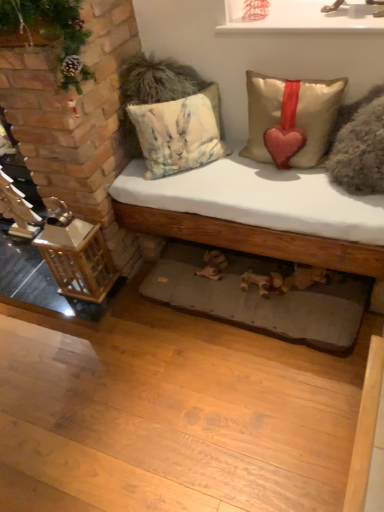
Question: Is watercolor fabric pillow at center, the third pillow from the right, facing towards white glossy shelf at upper center?

Choices:
 (A) no
 (B) yes

Answer: (A)

Question: Are watercolor fabric pillow at center, which is the 1th pillow in left-to-right order, and white glossy shelf at upper center far apart?

Choices:
 (A) yes
 (B) no

Answer: (B)

Question: From the image's perspective, is watercolor fabric pillow at center, the third pillow from the right, under white glossy shelf at upper center?

Choices:
 (A) yes
 (B) no

Answer: (A)

Question: Considering the relative sizes of watercolor fabric pillow at center, which is the 1th pillow in left-to-right order, and white glossy shelf at upper center in the image provided, is watercolor fabric pillow at center, which is the 1th pillow in left-to-right order, thinner than white glossy shelf at upper center?

Choices:
 (A) no
 (B) yes

Answer: (B)

Question: From the image's perspective, is watercolor fabric pillow at center, which is the 1th pillow in left-to-right order, on white glossy shelf at upper center?

Choices:
 (A) yes
 (B) no

Answer: (B)

Question: From the image's perspective, is wooden lantern at left located above or below white cotton bed at center?

Choices:
 (A) below
 (B) above

Answer: (A)

Question: Based on their sizes in the image, would you say wooden lantern at left is bigger or smaller than white cotton bed at center?

Choices:
 (A) big
 (B) small

Answer: (B)

Question: Based on their positions, is wooden lantern at left located to the left or right of white cotton bed at center?

Choices:
 (A) left
 (B) right

Answer: (A)

Question: From their relative heights in the image, would you say wooden lantern at left is taller or shorter than white cotton bed at center?

Choices:
 (A) tall
 (B) short

Answer: (B)

Question: Would you say white glossy shelf at upper center is inside or outside gray fabric mat at lower center?

Choices:
 (A) outside
 (B) inside

Answer: (A)

Question: From a real-world perspective, is white glossy shelf at upper center physically located above or below gray fabric mat at lower center?

Choices:
 (A) below
 (B) above

Answer: (B)

Question: Is white glossy shelf at upper center to the left or to the right of gray fabric mat at lower center in the image?

Choices:
 (A) left
 (B) right

Answer: (B)

Question: In the image, is white glossy shelf at upper center positioned in front of or behind gray fabric mat at lower center?

Choices:
 (A) behind
 (B) front

Answer: (B)

Question: Looking at the image, does white glossy shelf at upper center seem bigger or smaller compared to wooden lantern at left?

Choices:
 (A) big
 (B) small

Answer: (B)

Question: In the image, is white glossy shelf at upper center positioned in front of or behind wooden lantern at left?

Choices:
 (A) behind
 (B) front

Answer: (B)